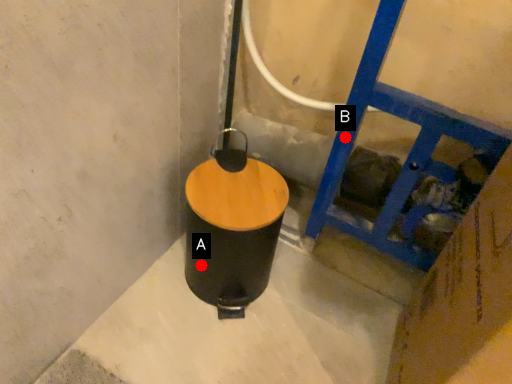
Question: Two points are circled on the image, labeled by A and B beside each circle. Which point is closer to the camera taking this photo?

Choices:
 (A) A is closer
 (B) B is closer

Answer: (B)